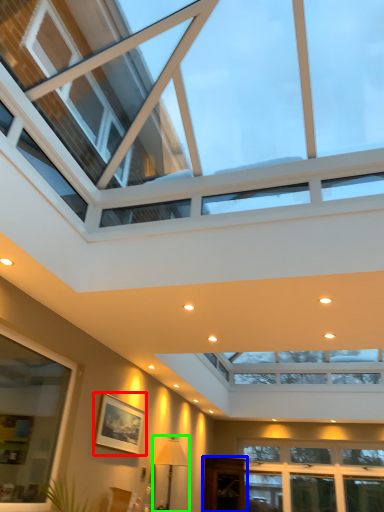
Question: Which object is positioned closest to picture frame (highlighted by a red box)? Select from glass door (highlighted by a blue box) and lamp (highlighted by a green box).

Choices:
 (A) glass door
 (B) lamp

Answer: (B)